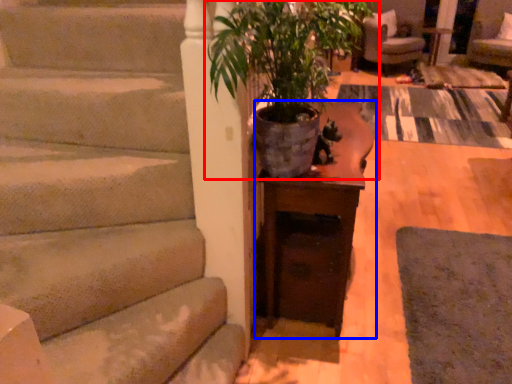
Question: Which of the following is the farthest to the observer, houseplant (highlighted by a red box) or table (highlighted by a blue box)?

Choices:
 (A) houseplant
 (B) table

Answer: (B)